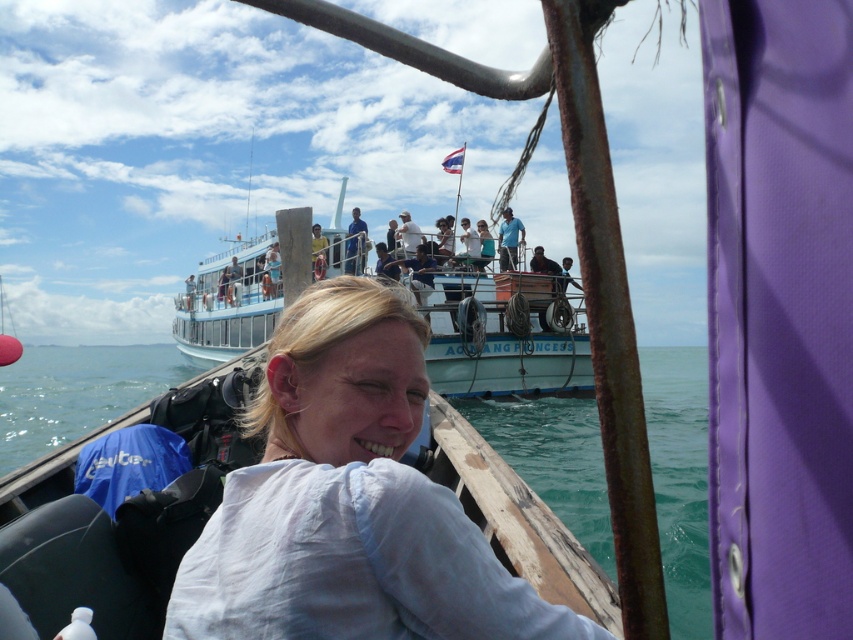
Does white cotton shirt at center come behind blue fabric shirt at upper center?

No, it is in front of blue fabric shirt at upper center.

Can you confirm if white cotton shirt at center is positioned above blue fabric shirt at upper center?

No, white cotton shirt at center is not above blue fabric shirt at upper center.

Which is behind, point (387, 428) or point (357, 250)?

Positioned behind is point (357, 250).

Identify the location of white cotton shirt at center. (350, 500).

Can you confirm if white cotton shirt at center is taller than white glossy boat at upper center?

No.

Is white cotton shirt at center above white glossy boat at upper center?

Incorrect, white cotton shirt at center is not positioned above white glossy boat at upper center.

Locate an element on the screen. white cotton shirt at center is located at coordinates (350, 500).

Can you confirm if white cotton shirt at center is positioned to the left of blue shirt at upper center?

Indeed, white cotton shirt at center is positioned on the left side of blue shirt at upper center.

Is point (318, 336) closer to camera compared to point (508, 264)?

That is True.

At what (x,y) coordinates should I click in order to perform the action: click on white cotton shirt at center. Please return your answer as a coordinate pair (x, y). The image size is (853, 640). Looking at the image, I should click on (350, 500).